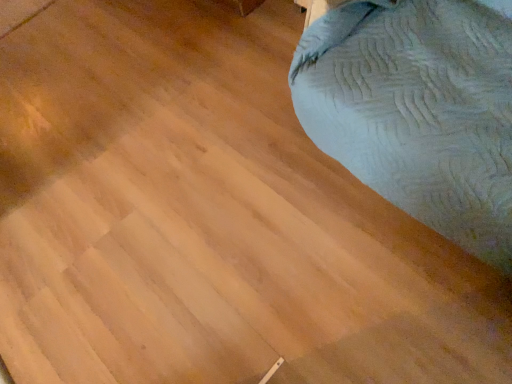
Describe the element at coordinates (417, 111) in the screenshot. The height and width of the screenshot is (384, 512). I see `light blue quilted fabric at upper right` at that location.

You are a GUI agent. You are given a task and a screenshot of the screen. Output one action in this format:
    pyautogui.click(x=<x>, y=<y>)
    Task: Click on the light blue quilted fabric at upper right
    
    Given the screenshot: What is the action you would take?
    pyautogui.click(x=417, y=111)

Locate an element on the screen. Image resolution: width=512 pixels, height=384 pixels. light blue quilted fabric at upper right is located at coordinates (417, 111).